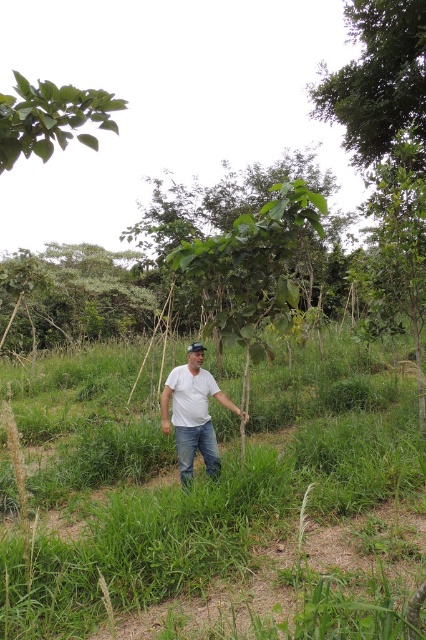
At what (x,y) coordinates should I click in order to perform the action: click on green grass at center. Please return your answer as a coordinate pair (x, y). The height and width of the screenshot is (640, 426). Looking at the image, I should click on (203, 492).

Is point (399, 420) less distant than point (221, 396)?

That is False.

Image resolution: width=426 pixels, height=640 pixels. What do you see at coordinates (203, 492) in the screenshot? I see `green grass at center` at bounding box center [203, 492].

The image size is (426, 640). In order to click on green grass at center in this screenshot , I will do `click(203, 492)`.

Does green grass at center appear on the left side of green leafy tree at upper left?

No, green grass at center is not to the left of green leafy tree at upper left.

Between green grass at center and green leafy tree at upper left, which one is positioned higher?

green leafy tree at upper left

Is point (86, 525) less distant than point (104, 109)?

No, it is behind (104, 109).

Where is `green grass at center`? The width and height of the screenshot is (426, 640). green grass at center is located at coordinates (203, 492).

Who is shorter, green leafy tree at center or white cotton shirt at center?

With less height is white cotton shirt at center.

Is green leafy tree at center wider than white cotton shirt at center?

Yes, green leafy tree at center is wider than white cotton shirt at center.

Image resolution: width=426 pixels, height=640 pixels. Identify the location of green leafy tree at center. (74, 292).